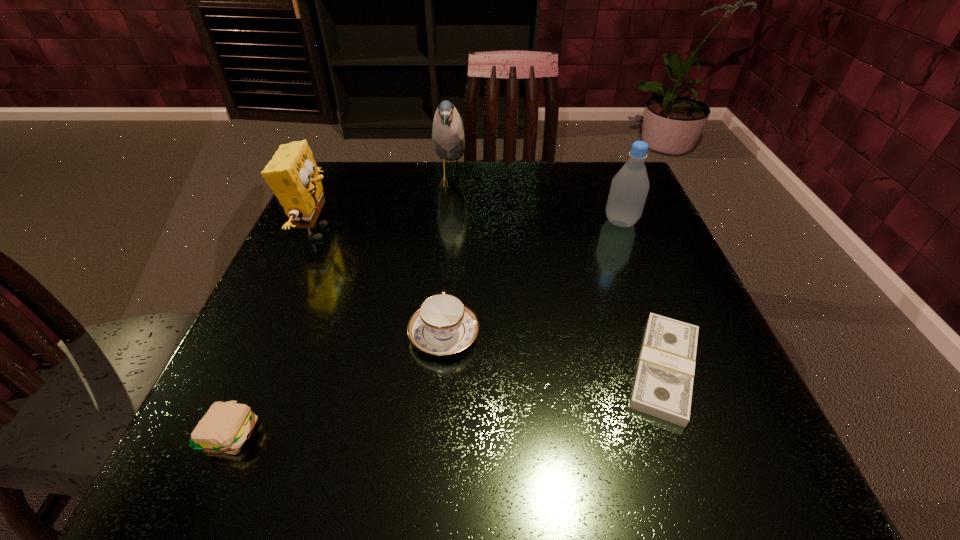
This screenshot has width=960, height=540. Find the location of `bottle that is at the right edge`. bottle that is at the right edge is located at coordinates (629, 188).

The height and width of the screenshot is (540, 960). Identify the location of dollar that is at the right edge. (663, 385).

At what (x,y) coordinates should I click in order to perform the action: click on object at the far left corner. Please return your answer as a coordinate pair (x, y). Looking at the image, I should click on (292, 174).

Identify the location of object positioned at the near left corner. This screenshot has width=960, height=540. (226, 426).

At what (x,y) coordinates should I click in order to perform the action: click on object present at the far right corner. Please return your answer as a coordinate pair (x, y). The height and width of the screenshot is (540, 960). Looking at the image, I should click on (x=629, y=188).

Locate an element on the screen. Image resolution: width=960 pixels, height=540 pixels. free space at the far edge of the desktop is located at coordinates (384, 199).

This screenshot has height=540, width=960. What are the coordinates of `free space at the near edge of the desktop` in the screenshot? It's located at (433, 443).

Identify the location of free space at the left edge of the desktop. The image size is (960, 540). (316, 388).

Where is `vacant region at the right edge of the desktop`? The height and width of the screenshot is (540, 960). vacant region at the right edge of the desktop is located at coordinates (632, 286).

Identify the location of free space at the far left corner of the desktop. The width and height of the screenshot is (960, 540). (380, 195).